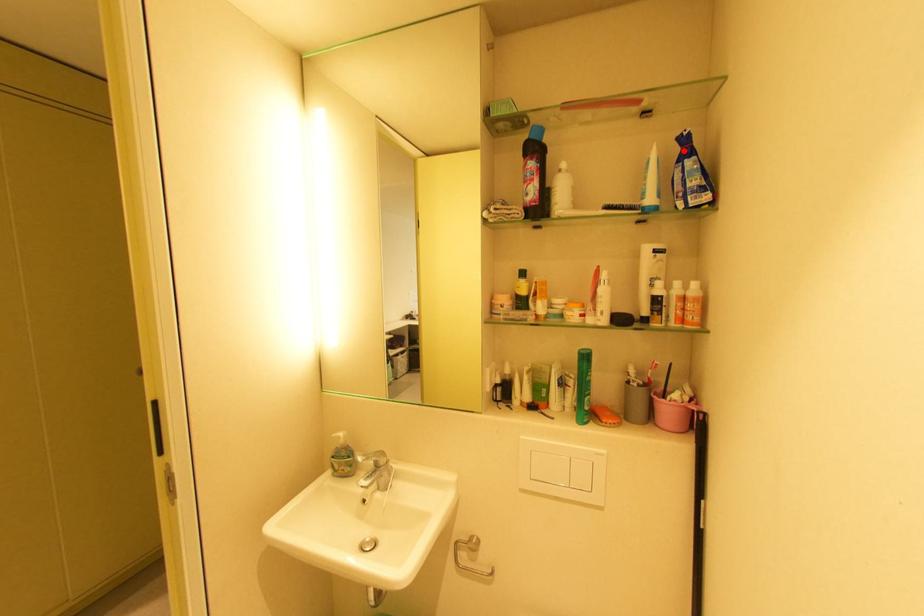
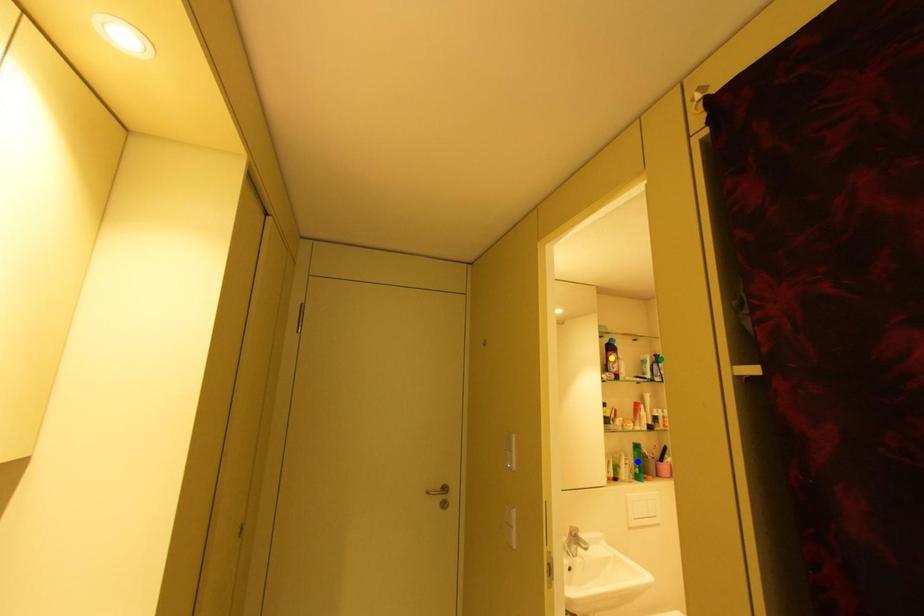
Question: I am providing you with two images of the same scene from different viewpoints. A red point is marked on the first image. You are given multiple points on the second image. Which point in image 2 is actually the same real-world point as the red point in image 1?

Choices:
 (A) blue point
 (B) green point
 (C) yellow point

Answer: (B)